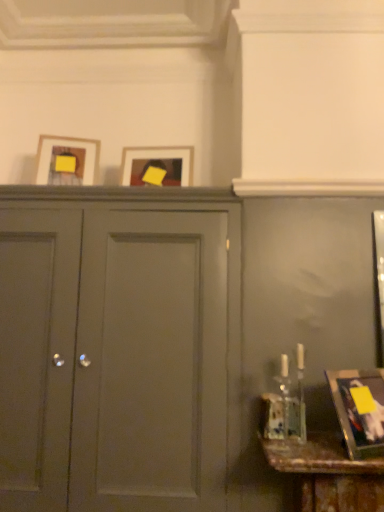
Question: Which is correct: metallic gold picture frame at lower right, marked as the 3th picture frame in a back-to-front arrangement, is inside matte gray cabinet at center, or outside of it?

Choices:
 (A) inside
 (B) outside

Answer: (B)

Question: In the image, is metallic gold picture frame at lower right, marked as the 3th picture frame in a back-to-front arrangement, positioned in front of or behind matte gray cabinet at center?

Choices:
 (A) behind
 (B) front

Answer: (B)

Question: Which of these objects is positioned farthest from the metallic gold picture frame at lower right, arranged as the 1th picture frame when viewed from the front?

Choices:
 (A) matte wooden picture frame at center, marked as the third picture frame in a front-to-back arrangement
 (B) matte gray cabinet at center
 (C) matte wooden picture frame at upper left, which is counted as the first picture frame, starting from the top

Answer: (C)

Question: Based on their relative distances, which object is nearer to the matte wooden picture frame at upper left, which is counted as the first picture frame, starting from the top?

Choices:
 (A) metallic gold picture frame at lower right, marked as the 3th picture frame in a back-to-front arrangement
 (B) matte gray cabinet at center
 (C) matte wooden picture frame at center, the 2th picture frame viewed from the right

Answer: (C)